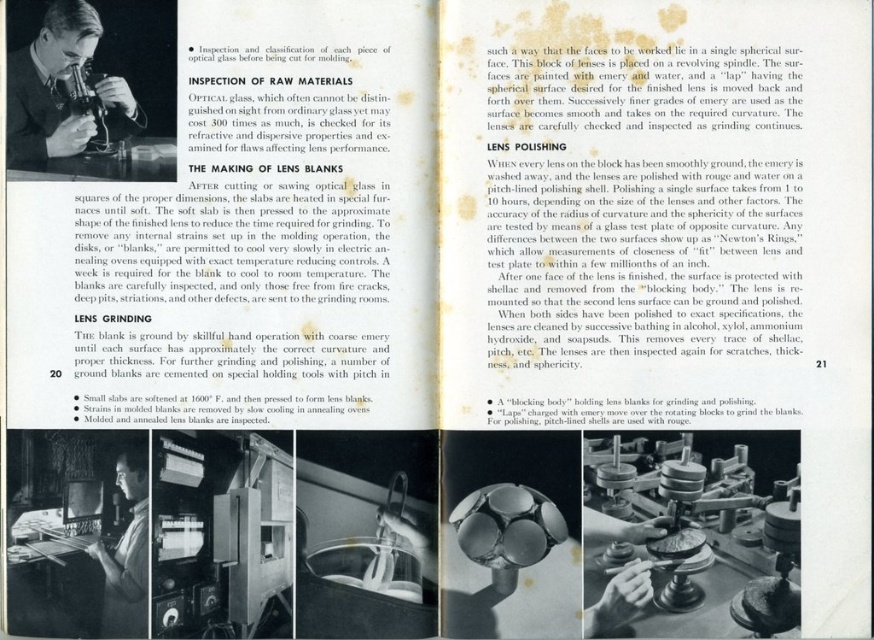
Question: Which point is farther from the camera taking this photo?

Choices:
 (A) (88, 128)
 (B) (127, 589)

Answer: (A)

Question: From the image, what is the correct spatial relationship of light brown wood microscope at upper left in relation to smooth skin face at lower left?

Choices:
 (A) left
 (B) right

Answer: (A)

Question: Does light brown wood microscope at upper left appear on the right side of smooth skin face at lower left?

Choices:
 (A) no
 (B) yes

Answer: (A)

Question: Which object is farther from the camera taking this photo?

Choices:
 (A) light brown wood microscope at upper left
 (B) smooth skin face at lower left

Answer: (A)

Question: Does light brown wood microscope at upper left have a larger size compared to smooth skin face at lower left?

Choices:
 (A) yes
 (B) no

Answer: (A)